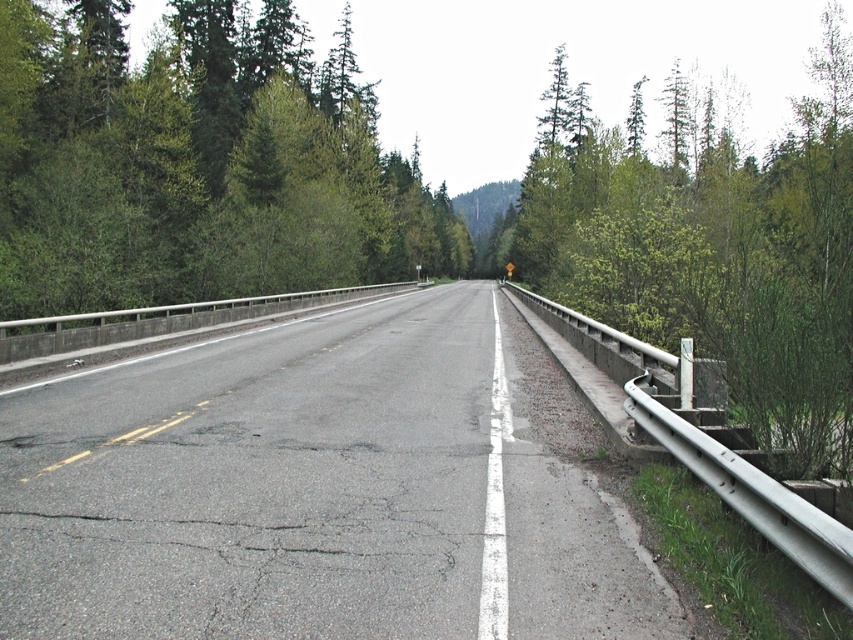
You are a hiker planning to cross the road in the image. You notice the green leafy trees at center and the green leafy shrub at right. Which of these two has a larger area coverage in the image?

The green leafy shrub at right has a larger area coverage than the green leafy trees at center.

You are a delivery truck driver who needs to deliver a package to a destination 50 meters ahead on the asphalt road at center. There are green leafy trees at center blocking the way. Can you safely navigate around them without hitting the trees?

The asphalt road at center and green leafy trees at center are 45.95 meters apart from each other. Since the distance between them is less than the required 50 meters to reach the destination, the truck cannot safely navigate around the trees without hitting them.